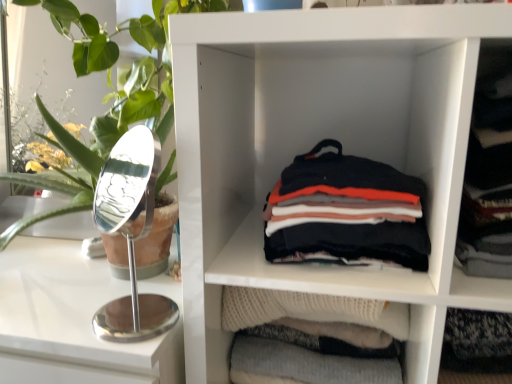
Question: From a real-world perspective, is white matte shelf at center physically above dark gray sweater at right?

Choices:
 (A) no
 (B) yes

Answer: (A)

Question: Is the position of white matte shelf at center more distant than that of dark gray sweater at right?

Choices:
 (A) yes
 (B) no

Answer: (B)

Question: Considering the relative sizes of white matte shelf at center and dark gray sweater at right in the image provided, is white matte shelf at center thinner than dark gray sweater at right?

Choices:
 (A) yes
 (B) no

Answer: (B)

Question: Is dark gray sweater at right completely or partially inside white matte shelf at center?

Choices:
 (A) yes
 (B) no

Answer: (A)

Question: Are white matte shelf at center and dark gray sweater at right making contact?

Choices:
 (A) no
 (B) yes

Answer: (A)

Question: Relative to green leafy plant at left, is white matte shelf at center in front or behind?

Choices:
 (A) front
 (B) behind

Answer: (B)

Question: From the image's perspective, is white matte shelf at center located above or below green leafy plant at left?

Choices:
 (A) above
 (B) below

Answer: (B)

Question: Looking at the image, does white matte shelf at center seem bigger or smaller compared to green leafy plant at left?

Choices:
 (A) big
 (B) small

Answer: (A)

Question: In terms of height, does white matte shelf at center look taller or shorter compared to green leafy plant at left?

Choices:
 (A) tall
 (B) short

Answer: (A)

Question: Is point (46, 256) closer or farther from the camera than point (488, 185)?

Choices:
 (A) farther
 (B) closer

Answer: (A)

Question: In terms of width, does white glossy counter at left look wider or thinner when compared to dark gray sweater at right?

Choices:
 (A) wide
 (B) thin

Answer: (A)

Question: Relative to dark gray sweater at right, is white glossy counter at left in front or behind?

Choices:
 (A) front
 (B) behind

Answer: (B)

Question: From the image's perspective, is white glossy counter at left located above or below dark gray sweater at right?

Choices:
 (A) above
 (B) below

Answer: (B)

Question: Is dark gray sweater at right in front of or behind soft cotton shirts at center in the image?

Choices:
 (A) front
 (B) behind

Answer: (A)

Question: From the image's perspective, relative to soft cotton shirts at center, is dark gray sweater at right above or below?

Choices:
 (A) below
 (B) above

Answer: (B)